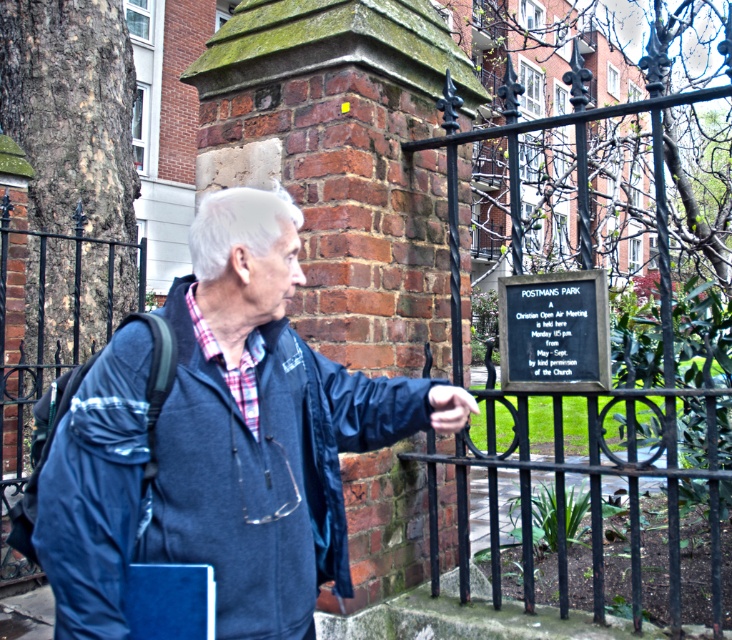
You are a tailor measuring the blue fleece jacket at lower left and the smooth skin hand at center. Which object has a greater size?

The blue fleece jacket at lower left has a larger size compared to the smooth skin hand at center.

What is located at the coordinates point (51,337) in the image?

The black metal fence at left is located at point (51,337).

You are a tourist trying to take a photo of the black polished stone plaque at center. The black wrought iron fence at center is blocking your view. Can you move around to the side to get a clear shot?

The black wrought iron fence at center is in front of the black polished stone plaque at center, so moving to the side might allow you to see around the fence and take a clear photo of the plaque.